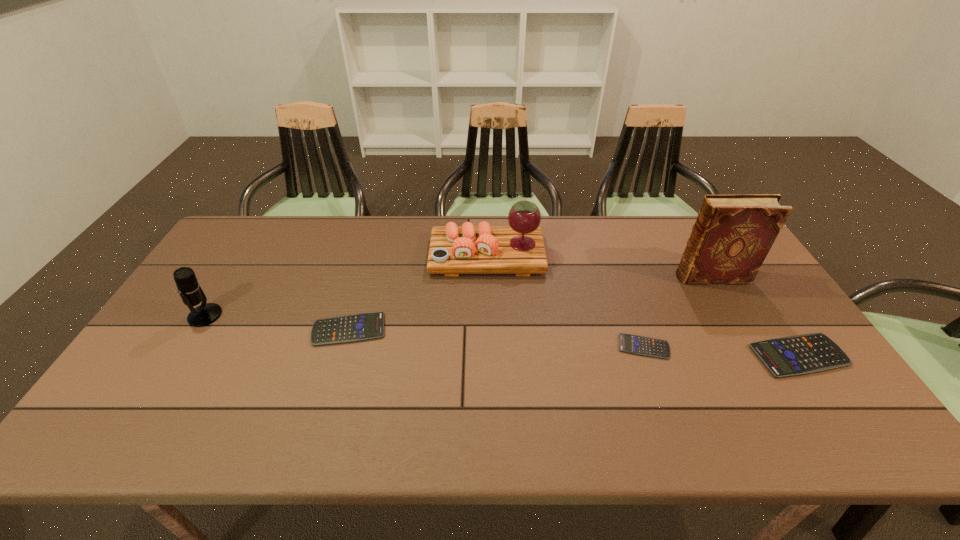
What are the coordinates of `vacant space located 0.300m on the left of the rightmost calculator` in the screenshot? It's located at (637, 356).

Identify the location of blank area located 0.310m on the front of the platter. (489, 359).

Locate an element on the screen. The height and width of the screenshot is (540, 960). vacant area situated on the back of the leftmost object is located at coordinates (262, 225).

Identify the location of free space located 0.120m on the spine side of the tallest object. (637, 277).

At what (x,y) coordinates should I click in order to perform the action: click on free location located 0.170m on the spine side of the tallest object. Please return your answer as a coordinate pair (x, y). Looking at the image, I should click on (621, 277).

Image resolution: width=960 pixels, height=540 pixels. I want to click on vacant space located on the spine side of the tallest object, so click(554, 277).

This screenshot has width=960, height=540. In order to click on object at the far edge in this screenshot , I will do `click(519, 249)`.

In order to click on object that is at the near edge in this screenshot , I will do `click(803, 354)`.

Find the location of a particular element. The height and width of the screenshot is (540, 960). object positioned at the left edge is located at coordinates (190, 291).

The width and height of the screenshot is (960, 540). Identify the location of calculator at the right edge. (803, 354).